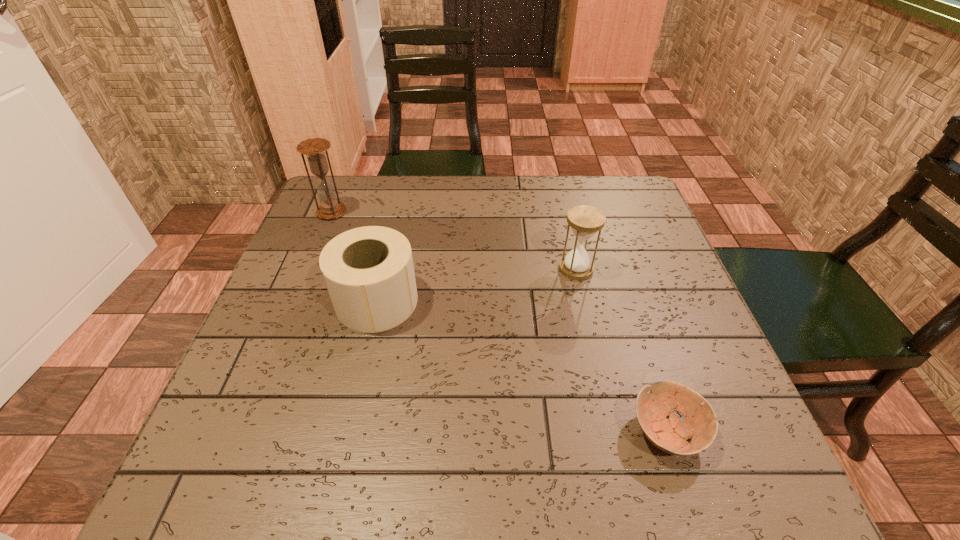
Identify the location of free space located 0.350m on the left of the bowl. Image resolution: width=960 pixels, height=540 pixels. (418, 431).

Where is `object that is at the far edge`? object that is at the far edge is located at coordinates (314, 148).

Identify the location of object at the near edge. (669, 435).

Find the location of a particular element. This screenshot has width=960, height=540. hourglass present at the left edge is located at coordinates (314, 148).

You are a GUI agent. You are given a task and a screenshot of the screen. Output one action in this format:
    pyautogui.click(x=<x>, y=<y>)
    Task: Click on the toilet tissue positioned at the left edge
    This screenshot has width=960, height=540.
    Given the screenshot: What is the action you would take?
    pyautogui.click(x=368, y=271)

Locate an element on the screen. The width and height of the screenshot is (960, 540). object present at the right edge is located at coordinates (669, 435).

At what (x,y) coordinates should I click in order to perform the action: click on object located in the far left corner section of the desktop. Please return your answer as a coordinate pair (x, y). The width and height of the screenshot is (960, 540). Looking at the image, I should click on (314, 148).

Image resolution: width=960 pixels, height=540 pixels. I want to click on object that is at the near right corner, so click(x=669, y=435).

Identify the location of vacant region at the far edge. (440, 193).

Find the location of `free space at the near edge of the desktop`. free space at the near edge of the desktop is located at coordinates (335, 481).